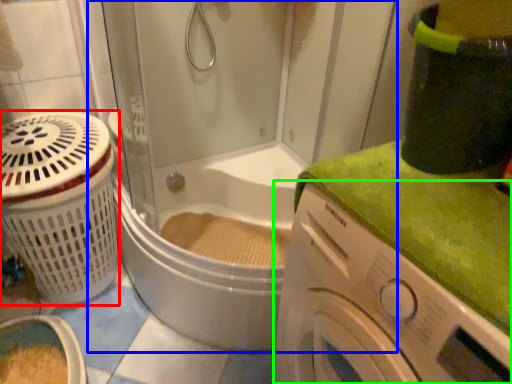
Question: Considering the real-world distances, which object is farthest from basket (highlighted by a red box)? shower door (highlighted by a blue box) or washing machine (highlighted by a green box)?

Choices:
 (A) shower door
 (B) washing machine

Answer: (B)